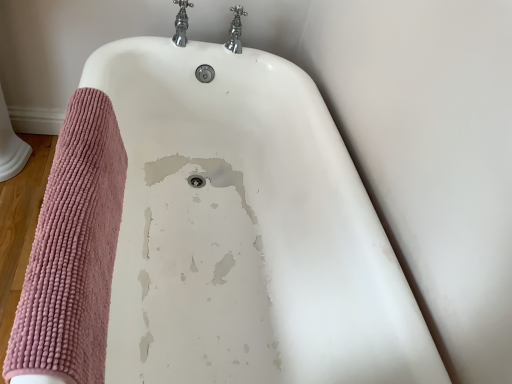
Locate an element on the screen. vacant space to the right of chrome metallic faucet at upper center, acting as the first tap starting from the right is located at coordinates (277, 66).